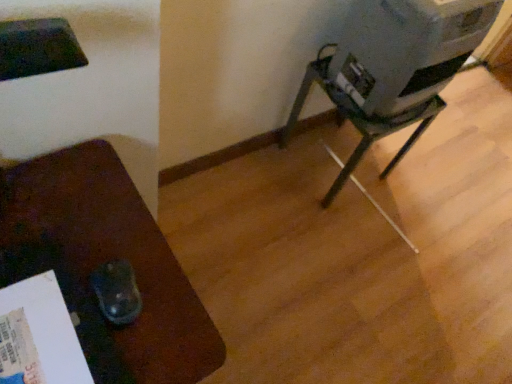
What are the coordinates of `matte brown mouse pad at left, which is the 2th furniture in top-to-bottom order` in the screenshot? It's located at (103, 262).

Is metallic gray water cooler at right oriented away from matte brown mouse pad at left, positioned as the 2th furniture in back-to-front order?

No, matte brown mouse pad at left, positioned as the 2th furniture in back-to-front order, is not at the back of metallic gray water cooler at right.

Is metallic gray water cooler at right taller or shorter than matte brown mouse pad at left, positioned as the 2th furniture in back-to-front order?

In the image, metallic gray water cooler at right appears to be shorter than matte brown mouse pad at left, positioned as the 2th furniture in back-to-front order.

Can you see metallic gray water cooler at right touching matte brown mouse pad at left, positioned as the 2th furniture in back-to-front order?

No, metallic gray water cooler at right is not next to matte brown mouse pad at left, positioned as the 2th furniture in back-to-front order.

From the picture: Does metallic gray water cooler at right appear on the right side of matte brown mouse pad at left, acting as the first furniture starting from the bottom?

Indeed, metallic gray water cooler at right is positioned on the right side of matte brown mouse pad at left, acting as the first furniture starting from the bottom.

Measure the distance between metallic gray projector at center-right, arranged as the second furniture when ordered from the bottom, and matte brown mouse pad at left, acting as the first furniture starting from the bottom.

The distance of metallic gray projector at center-right, arranged as the second furniture when ordered from the bottom, from matte brown mouse pad at left, acting as the first furniture starting from the bottom, is 36.27 inches.

From the image's perspective, is metallic gray projector at center-right, which ranks as the second furniture in front-to-back order, located above matte brown mouse pad at left, which is the second furniture in right-to-left order?

Correct, metallic gray projector at center-right, which ranks as the second furniture in front-to-back order, appears higher than matte brown mouse pad at left, which is the second furniture in right-to-left order, in the image.

Does metallic gray projector at center-right, arranged as the 1th furniture when viewed from the right, have a lesser height compared to matte brown mouse pad at left, which is the second furniture in right-to-left order?

Indeed, metallic gray projector at center-right, arranged as the 1th furniture when viewed from the right, has a lesser height compared to matte brown mouse pad at left, which is the second furniture in right-to-left order.

Find the location of a particular element. furniture located on the right of matte brown mouse pad at left, acting as the first furniture starting from the bottom is located at coordinates (358, 123).

From the image's perspective, is metallic gray water cooler at right located above metallic gray projector at center-right, arranged as the second furniture when ordered from the bottom?

Yes, from the image's perspective, metallic gray water cooler at right is over metallic gray projector at center-right, arranged as the second furniture when ordered from the bottom.

Is metallic gray water cooler at right not close to metallic gray projector at center-right, which ranks as the second furniture in front-to-back order?

No, metallic gray water cooler at right is not far from metallic gray projector at center-right, which ranks as the second furniture in front-to-back order.

Based on the photo, is metallic gray water cooler at right to the left or to the right of metallic gray projector at center-right, the 2th furniture in the left-to-right sequence, in the image?

Clearly, metallic gray water cooler at right is on the right of metallic gray projector at center-right, the 2th furniture in the left-to-right sequence, in the image.

Is metallic gray projector at center-right, arranged as the 1th furniture when viewed from the right, aimed at metallic gray water cooler at right?

No, metallic gray projector at center-right, arranged as the 1th furniture when viewed from the right, does not turn towards metallic gray water cooler at right.

Is metallic gray projector at center-right, arranged as the second furniture when ordered from the bottom, inside or outside of metallic gray water cooler at right?

metallic gray projector at center-right, arranged as the second furniture when ordered from the bottom, cannot be found inside metallic gray water cooler at right.

Considering the sizes of metallic gray projector at center-right, which ranks as the second furniture in front-to-back order, and metallic gray water cooler at right in the image, is metallic gray projector at center-right, which ranks as the second furniture in front-to-back order, bigger or smaller than metallic gray water cooler at right?

In the image, metallic gray projector at center-right, which ranks as the second furniture in front-to-back order, appears to be larger than metallic gray water cooler at right.

Can you confirm if metallic gray projector at center-right, which ranks as the first furniture in back-to-front order, is thinner than metallic gray water cooler at right?

No.

Considering the points (141, 331) and (368, 119), which point is behind, point (141, 331) or point (368, 119)?

The point (368, 119) is behind.

From the image's perspective, is matte brown mouse pad at left, which is the second furniture in right-to-left order, under metallic gray projector at center-right, the 1th furniture from the top?

Correct, matte brown mouse pad at left, which is the second furniture in right-to-left order, appears lower than metallic gray projector at center-right, the 1th furniture from the top, in the image.

Who is bigger, matte brown mouse pad at left, which is the first furniture from front to back, or metallic gray projector at center-right, arranged as the second furniture when ordered from the bottom?

With larger size is matte brown mouse pad at left, which is the first furniture from front to back.

Does matte brown mouse pad at left, which is the 2th furniture in top-to-bottom order, turn towards metallic gray projector at center-right, arranged as the second furniture when ordered from the bottom?

No.

Are matte brown mouse pad at left, acting as the first furniture starting from the bottom, and metallic gray water cooler at right beside each other?

matte brown mouse pad at left, acting as the first furniture starting from the bottom, and metallic gray water cooler at right are clearly separated.

From the picture: Is matte brown mouse pad at left, which is the first furniture from front to back, bigger or smaller than metallic gray water cooler at right?

matte brown mouse pad at left, which is the first furniture from front to back, is bigger than metallic gray water cooler at right.

Is matte brown mouse pad at left, which is the 2th furniture in top-to-bottom order, outside of metallic gray water cooler at right?

That's correct, matte brown mouse pad at left, which is the 2th furniture in top-to-bottom order, is outside of metallic gray water cooler at right.

From a real-world perspective, which furniture is the 1st one underneath the metallic gray water cooler at right? Please provide its 2D coordinates.

[(103, 262)]

Where is `furniture in front of the metallic gray projector at center-right, the 2th furniture in the left-to-right sequence`? furniture in front of the metallic gray projector at center-right, the 2th furniture in the left-to-right sequence is located at coordinates (103, 262).

Which object lies nearer to the anchor point metallic gray projector at center-right, which ranks as the second furniture in front-to-back order, metallic gray water cooler at right or matte brown mouse pad at left, the first furniture viewed from the left?

metallic gray water cooler at right lies closer to metallic gray projector at center-right, which ranks as the second furniture in front-to-back order, than the other object.

Based on their spatial positions, is matte brown mouse pad at left, which is the first furniture from front to back, or metallic gray projector at center-right, which ranks as the second furniture in front-to-back order, further from metallic gray water cooler at right?

Among the two, matte brown mouse pad at left, which is the first furniture from front to back, is located further to metallic gray water cooler at right.

Based on their spatial positions, is matte brown mouse pad at left, positioned as the 2th furniture in back-to-front order, or metallic gray water cooler at right closer to metallic gray projector at center-right, which ranks as the first furniture in back-to-front order?

metallic gray water cooler at right lies closer to metallic gray projector at center-right, which ranks as the first furniture in back-to-front order, than the other object.

Estimate the real-world distances between objects in this image. Which object is further from metallic gray water cooler at right, metallic gray projector at center-right, the 2th furniture in the left-to-right sequence, or matte brown mouse pad at left, which is the first furniture from front to back?

Based on the image, matte brown mouse pad at left, which is the first furniture from front to back, appears to be further to metallic gray water cooler at right.

From the image, which object appears to be nearer to matte brown mouse pad at left, the first furniture viewed from the left, metallic gray projector at center-right, which ranks as the first furniture in back-to-front order, or metallic gray water cooler at right?

metallic gray water cooler at right is closer to matte brown mouse pad at left, the first furniture viewed from the left.

When comparing their distances from matte brown mouse pad at left, which is the second furniture in right-to-left order, does metallic gray water cooler at right or metallic gray projector at center-right, the 2th furniture in the left-to-right sequence, seem further?

Based on the image, metallic gray projector at center-right, the 2th furniture in the left-to-right sequence, appears to be further to matte brown mouse pad at left, which is the second furniture in right-to-left order.

Identify the location of furniture situated between matte brown mouse pad at left, positioned as the 2th furniture in back-to-front order, and metallic gray water cooler at right from left to right. (358, 123).